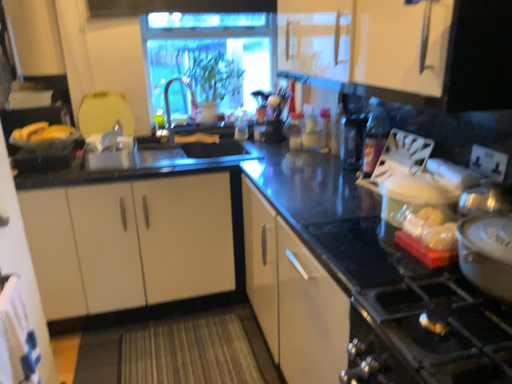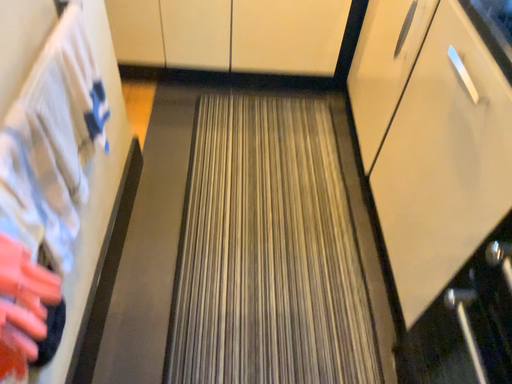
Question: Which way did the camera rotate in the video?

Choices:
 (A) rotated right
 (B) rotated left

Answer: (B)